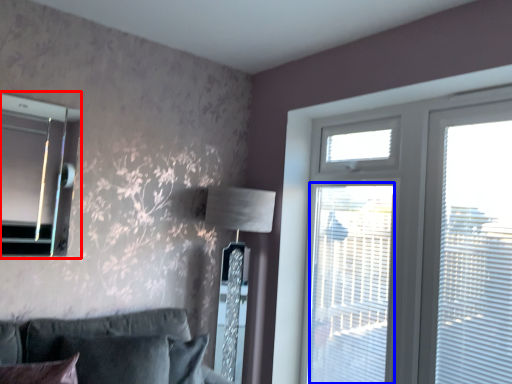
Question: Among these objects, which one is nearest to the camera, bay window (highlighted by a red box) or screen door (highlighted by a blue box)?

Choices:
 (A) bay window
 (B) screen door

Answer: (A)